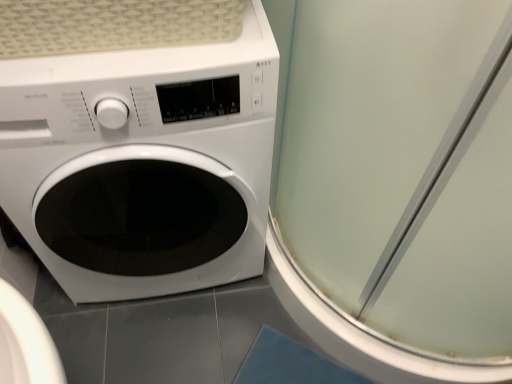
Question: Is transparent glass screen door at right not within white glossy washing machine at left?

Choices:
 (A) no
 (B) yes

Answer: (B)

Question: From a real-world perspective, is transparent glass screen door at right physically below white glossy washing machine at left?

Choices:
 (A) yes
 (B) no

Answer: (B)

Question: From a real-world perspective, is transparent glass screen door at right positioned over white glossy washing machine at left based on gravity?

Choices:
 (A) yes
 (B) no

Answer: (A)

Question: Considering the relative sizes of transparent glass screen door at right and white glossy washing machine at left in the image provided, is transparent glass screen door at right smaller than white glossy washing machine at left?

Choices:
 (A) no
 (B) yes

Answer: (A)

Question: From the image's perspective, is transparent glass screen door at right located beneath white glossy washing machine at left?

Choices:
 (A) yes
 (B) no

Answer: (B)

Question: Is transparent glass screen door at right thinner than white glossy washing machine at left?

Choices:
 (A) yes
 (B) no

Answer: (B)

Question: Is white glossy washing machine at left to the right of transparent glass screen door at right from the viewer's perspective?

Choices:
 (A) no
 (B) yes

Answer: (A)

Question: Can you confirm if white glossy washing machine at left is bigger than transparent glass screen door at right?

Choices:
 (A) yes
 (B) no

Answer: (B)

Question: From a real-world perspective, is white glossy washing machine at left on top of transparent glass screen door at right?

Choices:
 (A) no
 (B) yes

Answer: (A)

Question: From a real-world perspective, is white glossy washing machine at left under transparent glass screen door at right?

Choices:
 (A) no
 (B) yes

Answer: (B)

Question: From the image's perspective, is white glossy washing machine at left above transparent glass screen door at right?

Choices:
 (A) yes
 (B) no

Answer: (B)

Question: Is white glossy washing machine at left to the left of transparent glass screen door at right from the viewer's perspective?

Choices:
 (A) yes
 (B) no

Answer: (A)

Question: Is point (494, 96) closer or farther from the camera than point (159, 271)?

Choices:
 (A) closer
 (B) farther

Answer: (A)